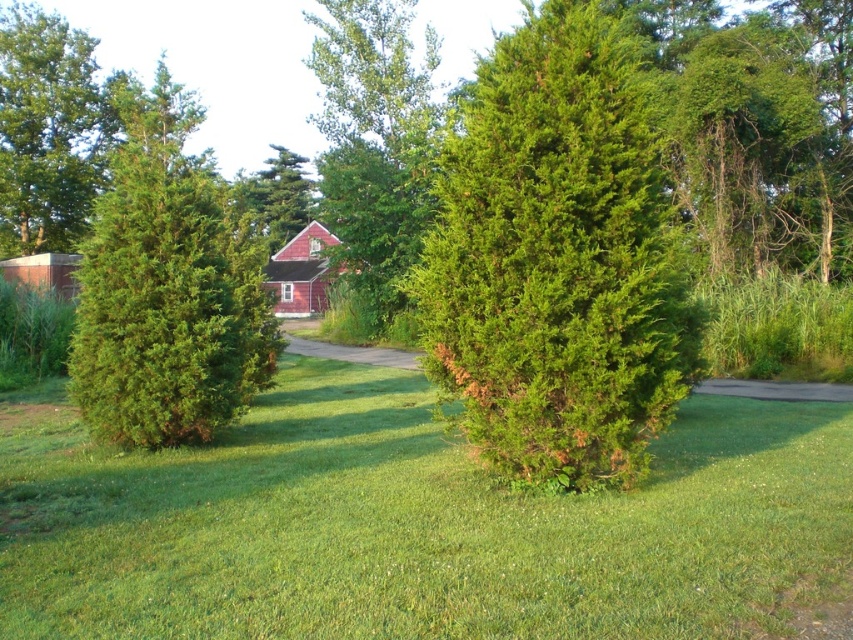
Between green textured bush at left and green leafy tree at upper right, which one has less height?

Standing shorter between the two is green leafy tree at upper right.

Does green textured bush at left appear on the right side of green leafy tree at upper right?

Incorrect, green textured bush at left is not on the right side of green leafy tree at upper right.

Find the location of a particular element. The image size is (853, 640). green textured bush at left is located at coordinates (167, 289).

Who is more distant from viewer, (398, 538) or (259, 380)?

The point (259, 380) is behind.

Does point (7, 513) lie behind point (129, 160)?

No, it is not.

Where is `green grass at center`? The height and width of the screenshot is (640, 853). green grass at center is located at coordinates (410, 524).

Who is higher up, green leafy tree at upper right or green leafy tree at center?

Positioned higher is green leafy tree at center.

How much distance is there between green leafy tree at upper right and green leafy tree at center?

15.33 meters

This screenshot has height=640, width=853. What do you see at coordinates (752, 148) in the screenshot?
I see `green leafy tree at upper right` at bounding box center [752, 148].

Where is `green leafy tree at upper right`? This screenshot has width=853, height=640. green leafy tree at upper right is located at coordinates (752, 148).